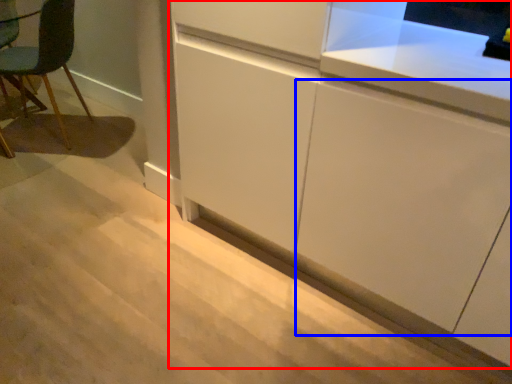
Question: Among these objects, which one is nearest to the camera, cabinetry (highlighted by a red box) or cabinetry (highlighted by a blue box)?

Choices:
 (A) cabinetry
 (B) cabinetry

Answer: (A)